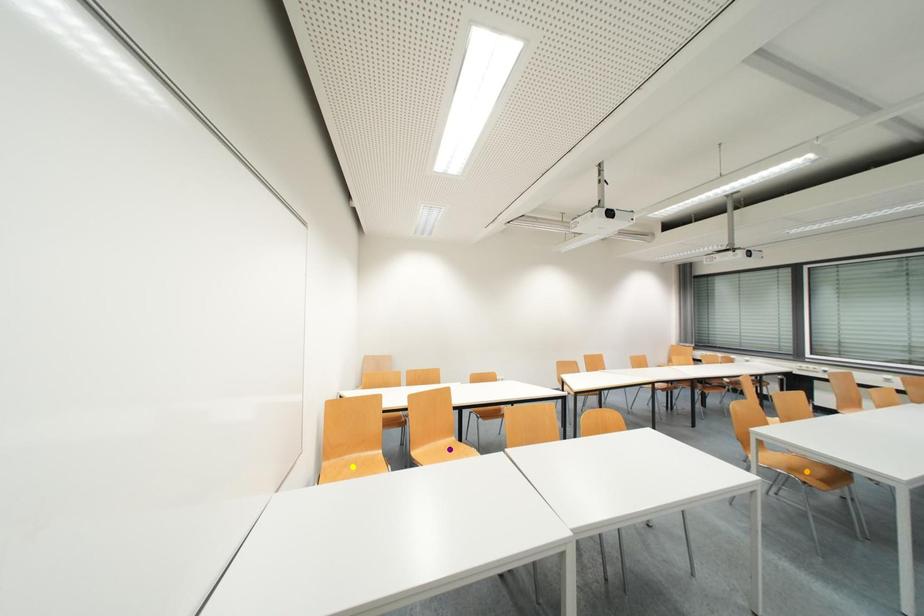
Order these from farthest to nearest:
1. orange point
2. yellow point
3. purple point

purple point
yellow point
orange point